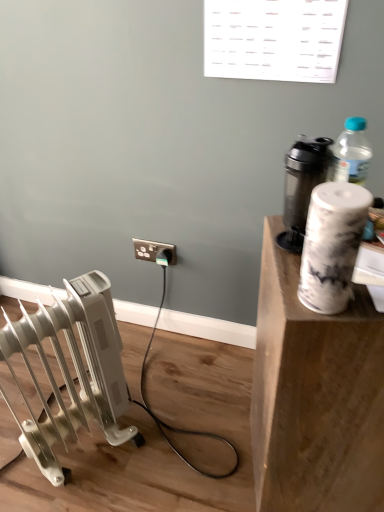
Question: Can you confirm if white marble cup at upper right is shorter than black plastic electric outlet at center?

Choices:
 (A) yes
 (B) no

Answer: (B)

Question: Is white marble cup at upper right bigger than black plastic electric outlet at center?

Choices:
 (A) no
 (B) yes

Answer: (B)

Question: From a real-world perspective, is white marble cup at upper right on top of black plastic electric outlet at center?

Choices:
 (A) yes
 (B) no

Answer: (A)

Question: Is white marble cup at upper right far away from black plastic electric outlet at center?

Choices:
 (A) no
 (B) yes

Answer: (A)

Question: Is white marble cup at upper right further to the viewer compared to black plastic electric outlet at center?

Choices:
 (A) no
 (B) yes

Answer: (A)

Question: Is white marble cup at upper right in front of or behind metallic gray shaker at upper right in the image?

Choices:
 (A) front
 (B) behind

Answer: (A)

Question: From the image's perspective, is white marble cup at upper right located above or below metallic gray shaker at upper right?

Choices:
 (A) below
 (B) above

Answer: (A)

Question: Is white marble cup at upper right spatially inside metallic gray shaker at upper right, or outside of it?

Choices:
 (A) inside
 (B) outside

Answer: (B)

Question: Considering the relative positions of white marble cup at upper right and metallic gray shaker at upper right in the image provided, is white marble cup at upper right to the left or to the right of metallic gray shaker at upper right?

Choices:
 (A) left
 (B) right

Answer: (B)

Question: From the image's perspective, is white marble paper towel at upper right above or below white plastic radiator at lower left?

Choices:
 (A) below
 (B) above

Answer: (B)

Question: Relative to white plastic radiator at lower left, is white marble paper towel at upper right in front or behind?

Choices:
 (A) behind
 (B) front

Answer: (B)

Question: Is white marble paper towel at upper right inside or outside of white plastic radiator at lower left?

Choices:
 (A) inside
 (B) outside

Answer: (B)

Question: From a real-world perspective, is white marble paper towel at upper right above or below white plastic radiator at lower left?

Choices:
 (A) above
 (B) below

Answer: (A)

Question: Is white marble paper towel at upper right wider or thinner than white marble cup at upper right?

Choices:
 (A) wide
 (B) thin

Answer: (B)

Question: Is white marble paper towel at upper right bigger or smaller than white marble cup at upper right?

Choices:
 (A) big
 (B) small

Answer: (B)